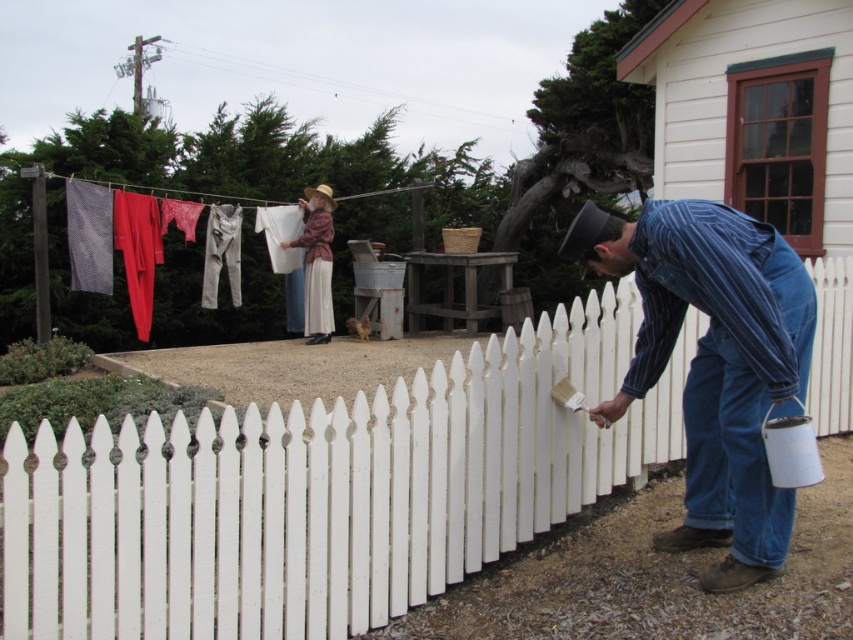
You are standing in the scene and want to hang a new red scarf on the laundry line. The laundry line is between the blue striped shirt at right and the matte white fabric at upper center. Which object should you place the scarf closer to if you want it to be higher?

The matte white fabric at upper center is positioned higher than the blue striped shirt at right, so placing the scarf closer to the matte white fabric at upper center would result in it being higher.

You are standing at the origin point of the coordinate system. The white wooden picket fence at center is located at point 0.770, 0.381. If you want to walk straight towards the fence, in which direction should you move?

To walk straight towards the white wooden picket fence at center located at coordinates (x=323, y=492) from the origin, you should move in the positive x and positive y direction since both coordinates are greater than zero.

You are a painter who needs to reach the white wooden picket fence at center and the matte white fabric at upper center. Which object is located to the right of the other?

The white wooden picket fence at center is positioned on the right side of matte white fabric at upper center.